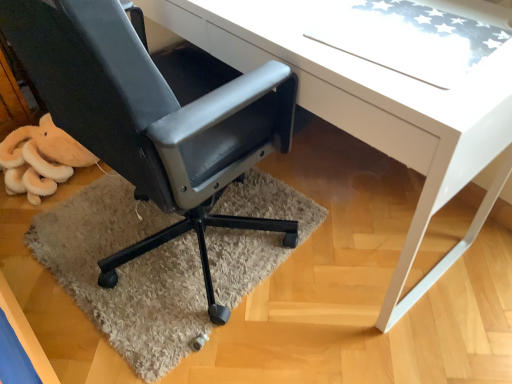
Locate an element on the screen. This screenshot has width=512, height=384. free spot below white glossy desk at center (from a real-world perspective) is located at coordinates point(337,214).